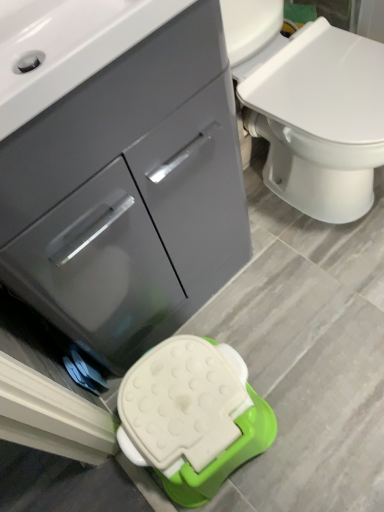
At what (x,y) coordinates should I click in order to perform the action: click on free space in front of matte gray cabinet at center. Please return your answer as a coordinate pair (x, y). This screenshot has height=512, width=384. Looking at the image, I should click on (272, 378).